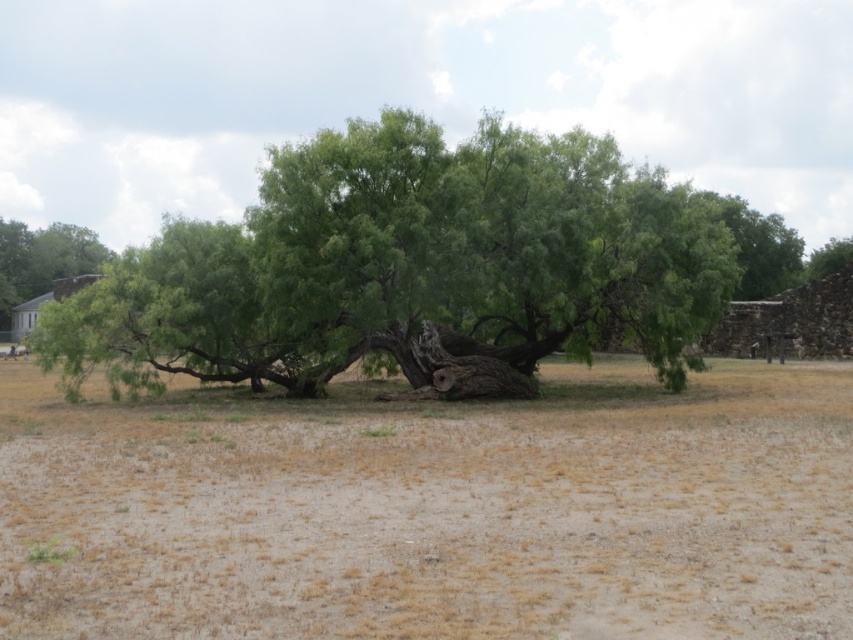
Which is above, brown dry grass at center or green leafy tree at center?

green leafy tree at center is higher up.

Consider the image. Who is more distant from viewer, (693, 394) or (457, 246)?

The point (693, 394) is behind.

Where is `brown dry grass at center`? brown dry grass at center is located at coordinates (433, 509).

Who is more distant from viewer, (650, 186) or (82, 275)?

Positioned behind is point (82, 275).

Which is below, green leafy tree at center or brown brick chimney at left?

brown brick chimney at left is lower down.

Where is `green leafy tree at center`? Image resolution: width=853 pixels, height=640 pixels. green leafy tree at center is located at coordinates (409, 268).

This screenshot has height=640, width=853. I want to click on green leafy tree at center, so click(409, 268).

Which is more to the left, green leafy tree at center or green leafy tree at left?

green leafy tree at left

Does green leafy tree at center lie behind green leafy tree at left?

That is False.

Is point (529, 218) less distant than point (83, 250)?

Yes, point (529, 218) is closer to viewer.

I want to click on green leafy tree at center, so click(x=409, y=268).